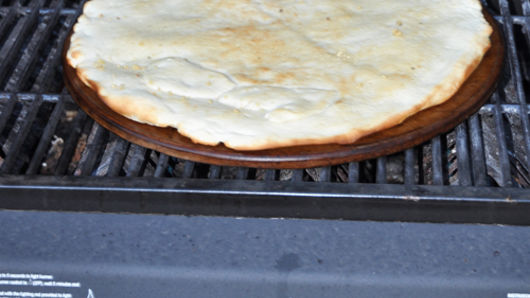
Find the location of a particular element. brown round plate is located at coordinates (282, 160).